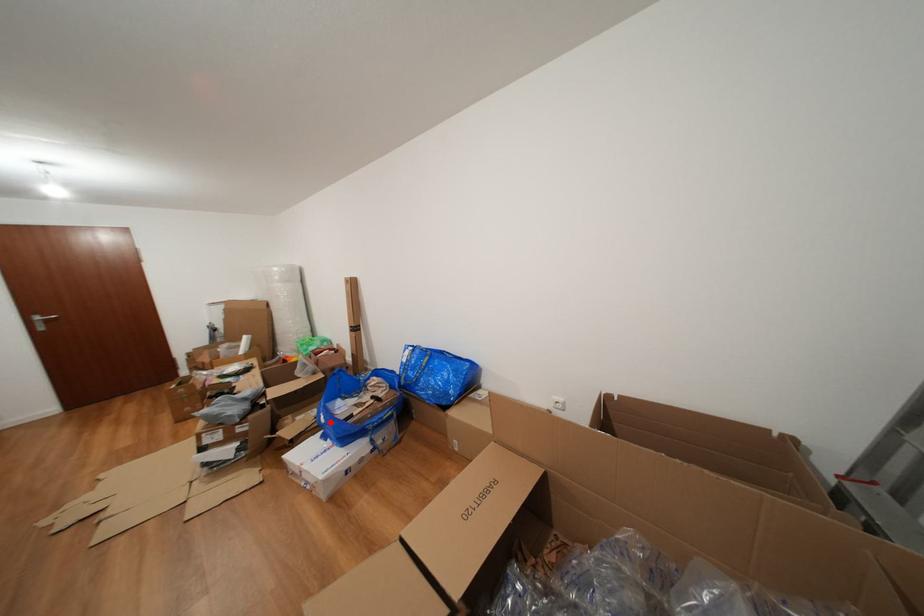
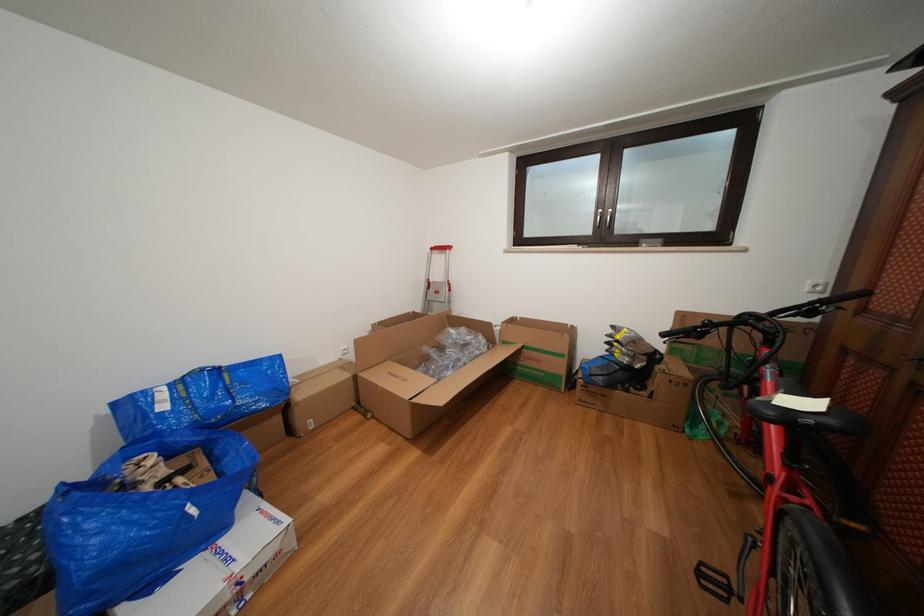
Question: I am providing you with two images of the same scene from different viewpoints. Given a red point in image1, look at the same physical point in image2. Is it:

Choices:
 (A) Closer to the viewpoint
 (B) Farther from the viewpoint

Answer: (B)